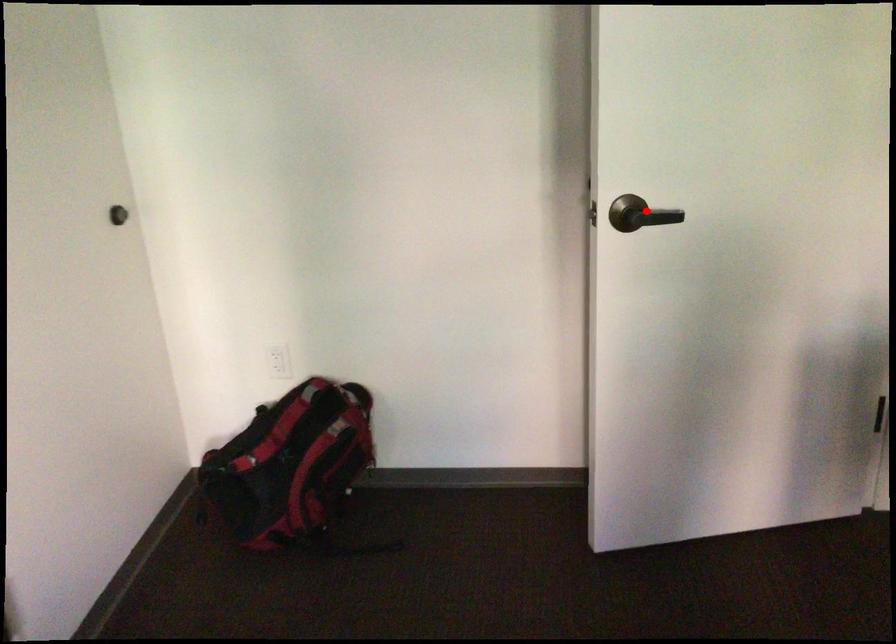
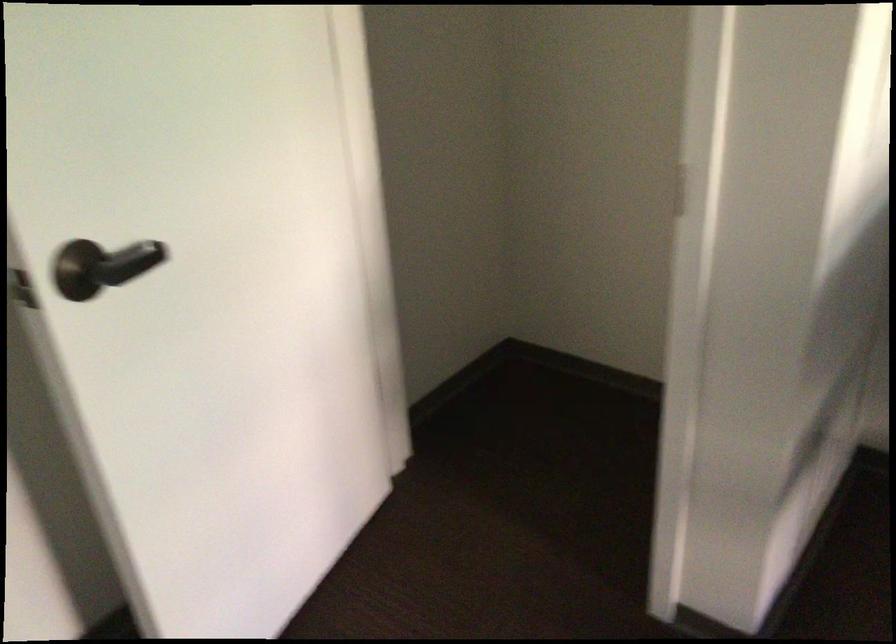
The point at the highlighted location is marked in the first image. Where is the corresponding point in the second image?

(107, 265)